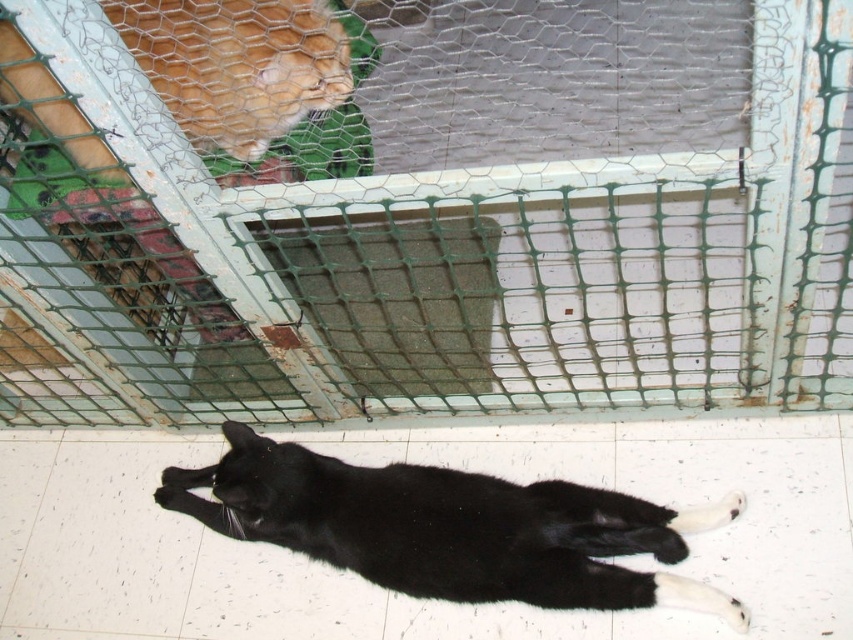
You are a veterinarian examining the black fur cat at lower center. You need to administer an injection at point (450, 529). Where exactly should you aim the injection on the cat?

The injection should be administered at the point (450, 529) on the black fur cat at lower center.

You are a veterinarian examining the cats in the shelter. You need to determine if the orange fur cat at upper left can jump over the green wire mesh at upper center to reach the other cat. Based on their sizes, can it?

The green wire mesh at upper center is taller than orange fur cat at upper left, so the orange fur cat at upper left cannot jump over the green wire mesh at upper center to reach the other cat.